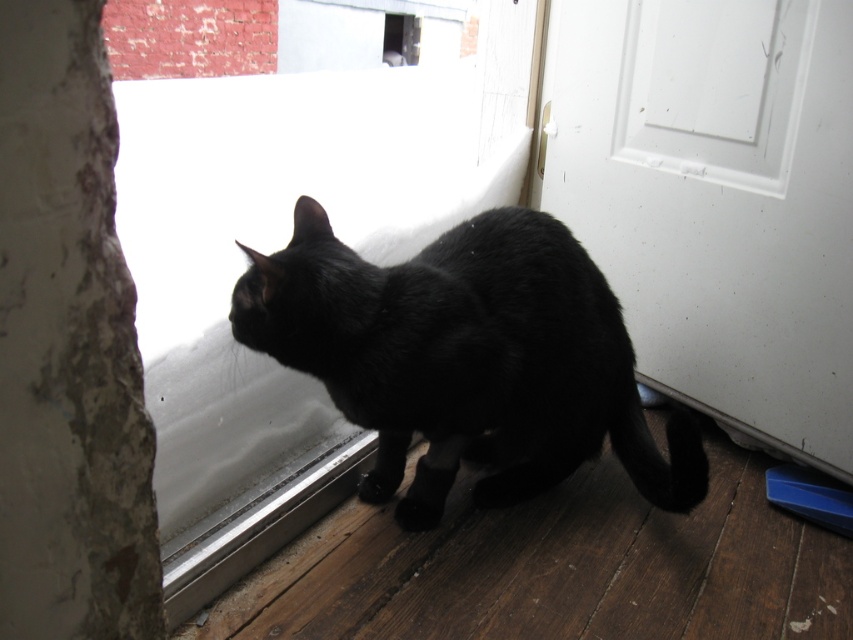
You are standing in the room where the black cat is and want to exit through the door. Where should you go to find the white glossy screen door at lower right?

The white glossy screen door at lower right is located at point [718,200], so you should go to the lower right area of the room to find it.

You are standing in a room and want to look outside through the transparent glass window at center and the white glossy screen door at lower right. Which object should you move towards if you want to see the outside world more clearly?

The transparent glass window at center allows for clearer viewing of the outside world compared to the white glossy screen door at lower right because windows are typically designed for clear visibility, while screen doors may have mesh or other materials that obstruct the view slightly.

You are a delivery person trying to see the black matte fur cat at center through the transparent glass window at center. Can you see the cat clearly through the window?

The black matte fur cat at center is behind the transparent glass window at center, so yes, you can see the cat clearly through the window.